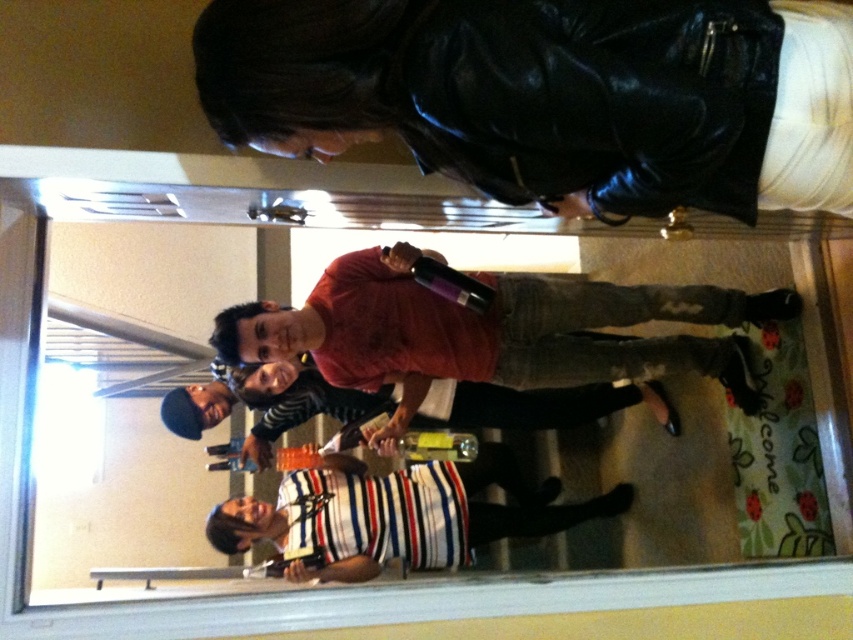
Question: Based on their relative distances, which object is nearer to the matte red shirt at center?

Choices:
 (A) black leather jacket at upper center
 (B) striped cotton shirt at center

Answer: (B)

Question: Based on their relative distances, which object is farther from the striped cotton shirt at center?

Choices:
 (A) matte red shirt at center
 (B) black leather jacket at upper center

Answer: (B)

Question: Which object appears closest to the camera in this image?

Choices:
 (A) striped fabric shirt at lower center
 (B) striped cotton shirt at center
 (C) matte red shirt at center
 (D) black leather jacket at upper center

Answer: (D)

Question: Can you confirm if matte red shirt at center is wider than striped cotton shirt at center?

Choices:
 (A) yes
 (B) no

Answer: (B)

Question: Is the position of black leather jacket at upper center less distant than that of matte red shirt at center?

Choices:
 (A) yes
 (B) no

Answer: (A)

Question: Is striped fabric shirt at lower center thinner than striped cotton shirt at center?

Choices:
 (A) yes
 (B) no

Answer: (A)